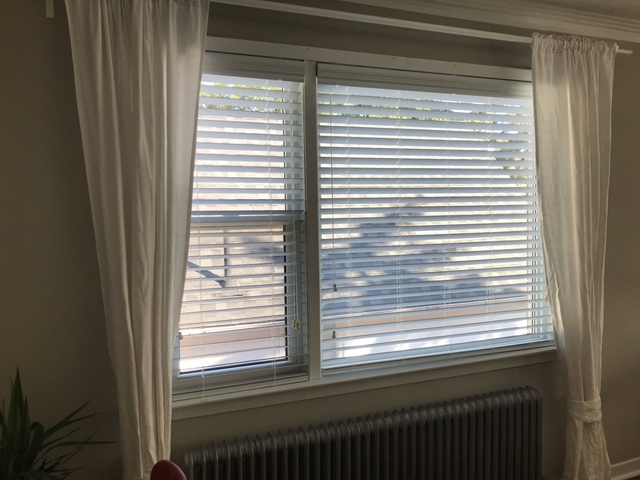
Find the location of a particular element. radiator is located at coordinates (385, 440).